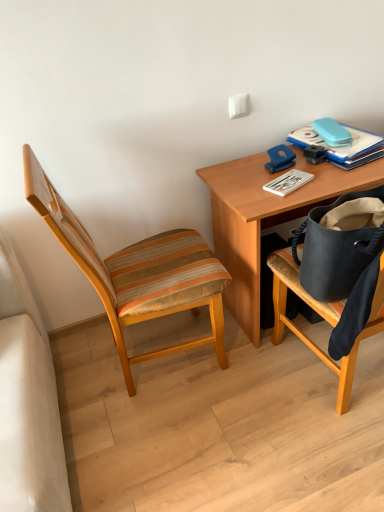
I want to click on vacant area that is in front of wooden striped chair at left, so click(180, 443).